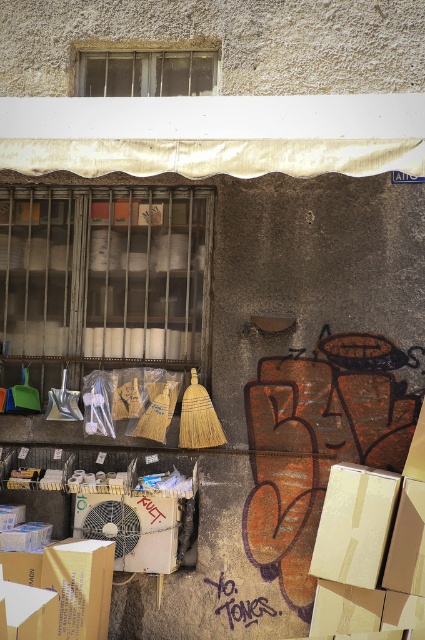
You are a delivery person who needs to place a white cardboard box at center on a shelf that is 5 feet away from the window with metal bars. Can you safely place the box without needing to move any items on the shelf?

The white cardboard box at center is 16.67 feet away from the window with metal bars. Since the shelf is only 5 feet away from the window, the box is placed much farther than the required distance, so you would need to move it closer to the window to meet the requirement.

You are organizing items in the shop and need to place a new large item. Which box from the white cardboard box at center and the brown cardboard box at lower left should you choose to store it?

The white cardboard box at center is bigger than the brown cardboard box at lower left, so you should choose the white cardboard box at center to store the large item.

You are organizing items on the shelves below the window with the white awning. You have a white cardboard box at center and a brown cardboard box at lower left. Which box requires more vertical space to place on the shelf?

The white cardboard box at center requires more vertical space because it is taller than the brown cardboard box at lower left.